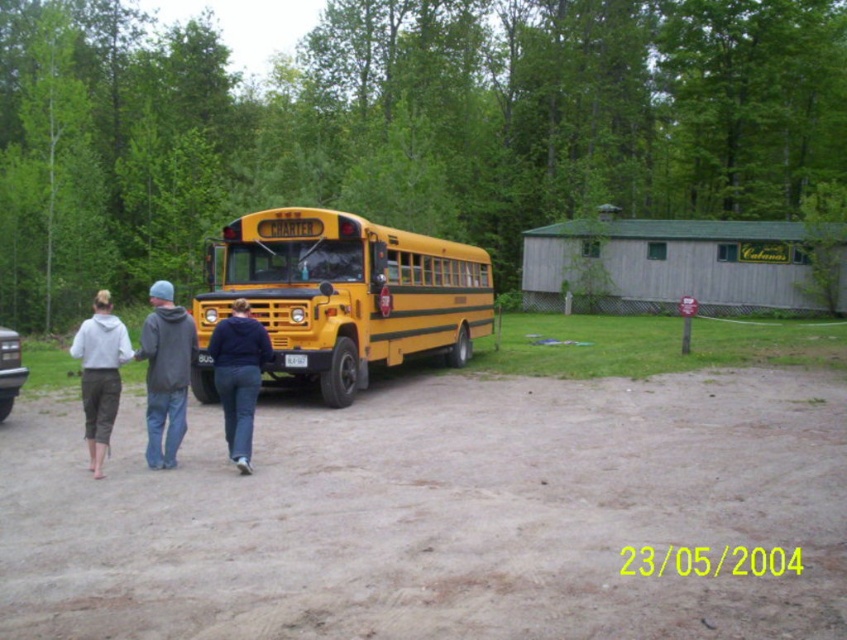
You are standing at the camera position and want to take a photo of the yellow matte bus at center without any people blocking it. Which person wearing a matte gray hoodie at lower left should you ask to move so the bus is fully visible?

The matte gray hoodie at lower left is behind the yellow matte bus at center, so it is already positioned in a way that they are not blocking the bus. Therefore, no one needs to move to ensure the bus is fully visible.

You are standing in front of the yellow charter bus and want to greet the person wearing the gray hoodie at center and the matte gray hoodie at lower left. Which person should you approach first to greet them?

You should approach the gray hoodie at center first because it is closer to you than the matte gray hoodie at lower left, which is further away.

You are a tour guide standing near the yellow charter bus. You need to direct a group member who is wearing either the navy blue hoodie at center or the matte gray hoodie at lower left to come to you. Which one is closer to you?

The navy blue hoodie at center and the matte gray hoodie at lower left are 1.92 meters apart. Without knowing their exact positions relative to you, it is impossible to determine which is closer.